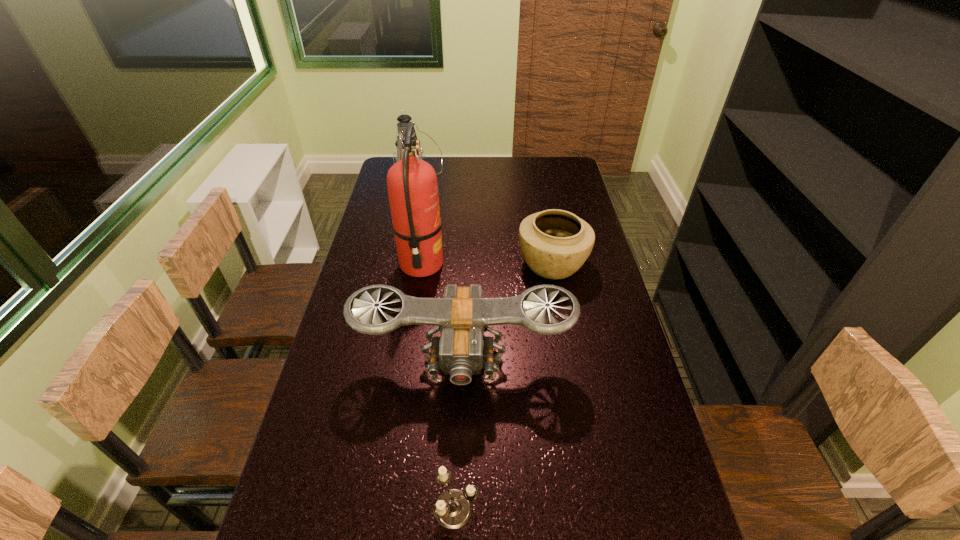
Locate an element on the screen. The width and height of the screenshot is (960, 540). vacant area situated on the front-facing side of the third shortest object is located at coordinates (460, 471).

Identify the location of free space located 0.190m on the front of the pottery. (564, 333).

Locate an element on the screen. The image size is (960, 540). free point located on the right of the nearest object is located at coordinates (623, 509).

I want to click on object present at the far edge, so click(x=404, y=119).

You are a GUI agent. You are given a task and a screenshot of the screen. Output one action in this format:
    pyautogui.click(x=<x>, y=<y>)
    Task: Click on the fire extinguisher that is at the left edge
    The height and width of the screenshot is (540, 960).
    Given the screenshot: What is the action you would take?
    pyautogui.click(x=412, y=186)

Identify the location of oil lamp that is at the left edge. The width and height of the screenshot is (960, 540). (404, 119).

The height and width of the screenshot is (540, 960). Identify the location of drone that is positioned at the left edge. (462, 316).

Identify the location of object that is positioned at the right edge. This screenshot has width=960, height=540. (554, 243).

The width and height of the screenshot is (960, 540). Find the location of `object that is at the far left corner`. object that is at the far left corner is located at coordinates (404, 119).

Identify the location of vacant space at the far edge. (440, 167).